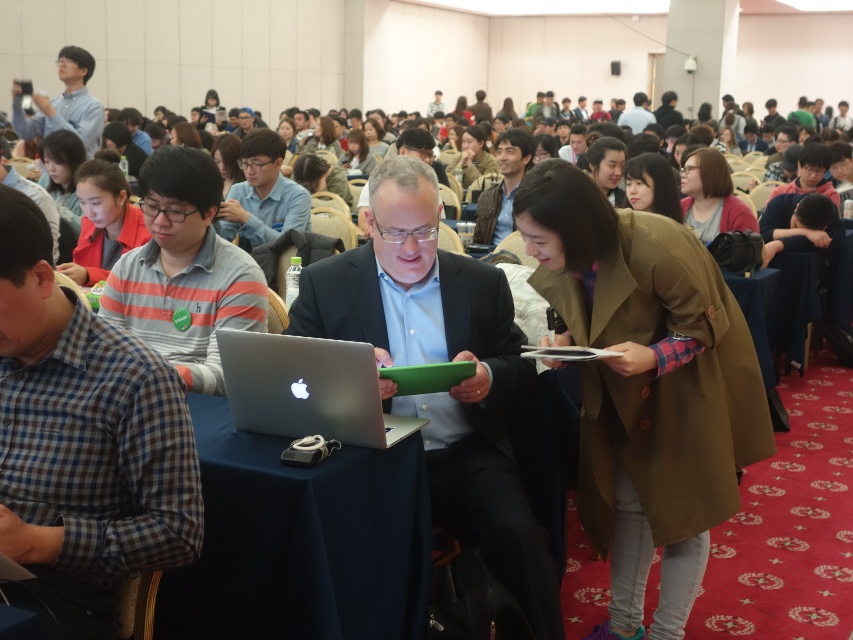
You are organizing an event and need to place a 10 meter long banner between the matte blue shirt at upper left and the matte black jacket at upper center. Based on the scene, will the banner fit perfectly between them?

The distance between the matte blue shirt at upper left and the matte black jacket at upper center is 9.80 meters, so the 10 meter long banner will be slightly too long to fit perfectly between them.